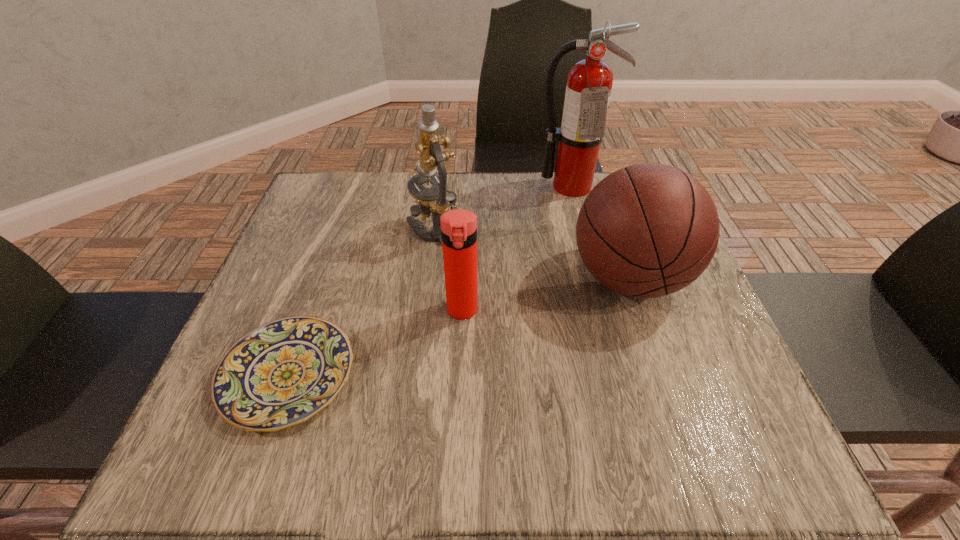
At what (x,y) coordinates should I click in order to perform the action: click on vacant space at the far edge. Please return your answer as a coordinate pair (x, y). The height and width of the screenshot is (540, 960). Looking at the image, I should click on (516, 181).

In the image, there is a desktop. Identify the location of vacant area at the near edge. 655,443.

Find the location of a particular element. Image resolution: width=960 pixels, height=540 pixels. vacant space at the left edge of the desktop is located at coordinates point(291,305).

Where is `free point at the right edge`? free point at the right edge is located at coordinates (710, 375).

Identify the location of free space at the far left corner of the desktop. (324, 207).

The width and height of the screenshot is (960, 540). Identify the location of free spot at the near right corner of the desktop. (764, 454).

Locate an element on the screen. This screenshot has width=960, height=540. vacant area that lies between the plate and the thermos bottle is located at coordinates (375, 343).

Find the location of a particular element. The image size is (960, 540). vacant area that lies between the second tallest object and the basketball is located at coordinates pos(530,253).

The width and height of the screenshot is (960, 540). I want to click on empty location between the leftmost object and the microscope, so click(360, 301).

Find the location of a particular element. free space between the leftmost object and the thermos bottle is located at coordinates (375, 343).